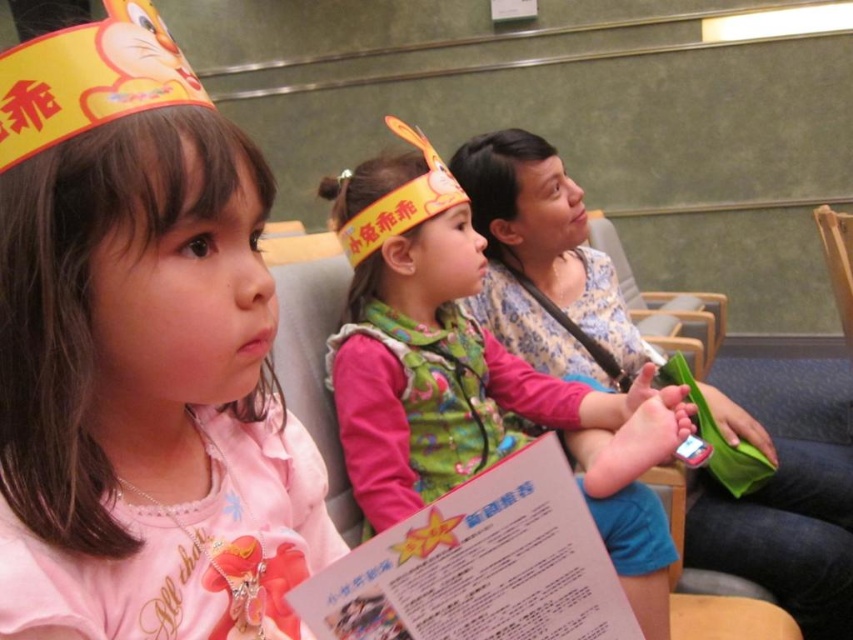
You are standing at the entrance of the waiting area and see two points marked in the scene. Which point is closer to you, point (293, 563) or point (676, 392)?

Point (293, 563) is in front of point (676, 392), so it is closer to you.

You are a photographer trying to capture a closeup of the pink fabric shirt at center and the matte pink shirt at center. Since both shirts are in the same area, can you focus on both at the same time?

The pink fabric shirt at center is positioned over the matte pink shirt at center, so you cannot focus on both at the same time because one is covering the other.

You are a tailor observing two pink shirts displayed at the center of the image. Which one is smaller in size between the pink fabric shirt at center and the matte pink shirt at center?

The pink fabric shirt at center is smaller in size compared to the matte pink shirt at center according to the description.